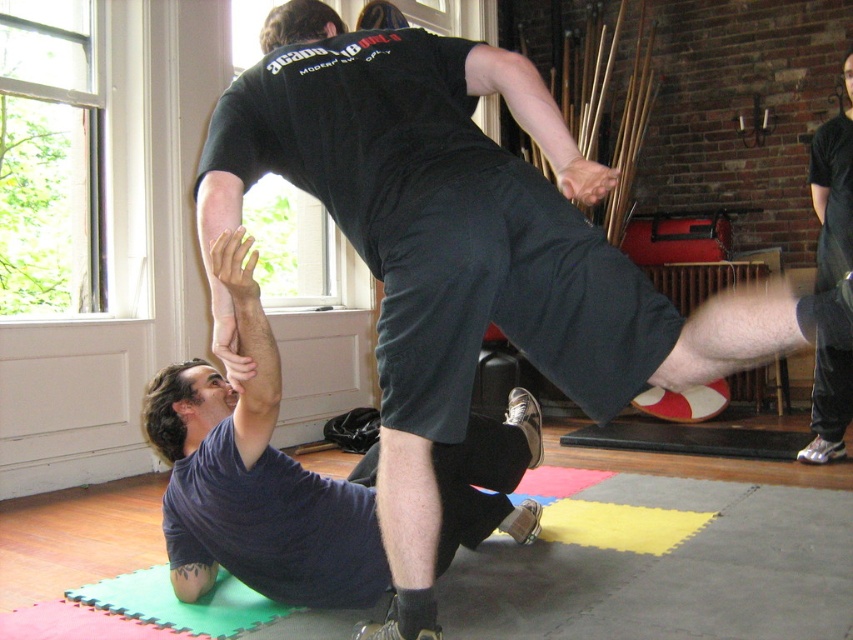
Is dark blue fabric squat at lower left further to the viewer compared to green foam yoga mat at lower left?

No, dark blue fabric squat at lower left is in front of green foam yoga mat at lower left.

Between dark blue fabric squat at lower left and green foam yoga mat at lower left, which one appears on the right side from the viewer's perspective?

dark blue fabric squat at lower left is more to the right.

Measure the distance between point (291, 476) and camera.

Point (291, 476) is 2.25 meters from camera.

Locate an element on the screen. dark blue fabric squat at lower left is located at coordinates (254, 477).